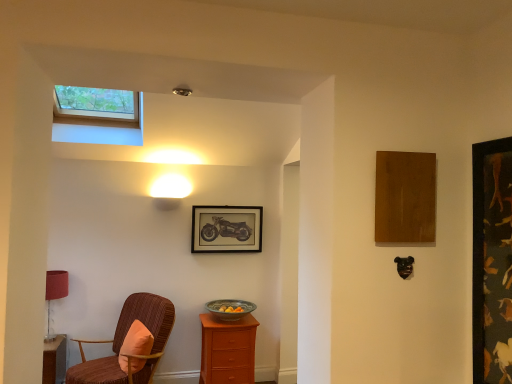
Question: Based on their sizes in the image, would you say velvet brown chair with orange cushion at left is bigger or smaller than matte black motorcycle at center, marked as the second picture frame in a right-to-left arrangement?

Choices:
 (A) small
 (B) big

Answer: (B)

Question: Relative to matte black motorcycle at center, the 1th picture frame when ordered from back to front, is velvet brown chair with orange cushion at left in front or behind?

Choices:
 (A) behind
 (B) front

Answer: (B)

Question: Estimate the real-world distances between objects in this image. Which object is closer to the orange fabric pillow at lower left?

Choices:
 (A) wooden nightstand at center
 (B) earthy ceramic bowl at center
 (C) velvet brown chair with orange cushion at left
 (D) dark wood picture frame at right, marked as the 1th picture frame in a front-to-back arrangement
 (E) matte red lampshade at left

Answer: (C)

Question: Which object is positioned closest to the matte red lampshade at left?

Choices:
 (A) earthy ceramic bowl at center
 (B) matte black motorcycle at center, marked as the second picture frame in a right-to-left arrangement
 (C) velvet brown chair with orange cushion at left
 (D) dark wood picture frame at right, acting as the 2th picture frame starting from the back
 (E) wooden nightstand at center

Answer: (C)